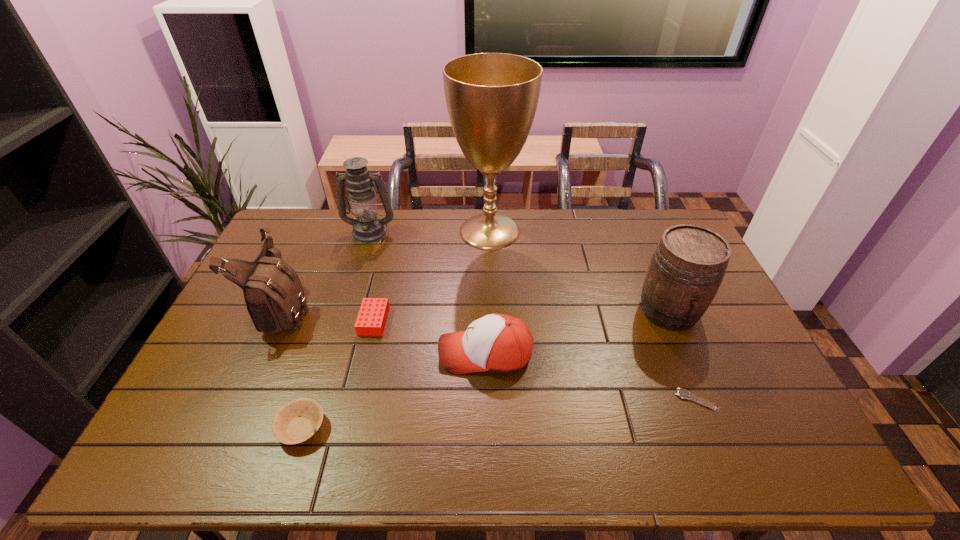
I want to click on trophy cup, so click(491, 98).

You are a GUI agent. You are given a task and a screenshot of the screen. Output one action in this format:
    pyautogui.click(x=<x>, y=<y>)
    Task: Click on the oil lamp
    This screenshot has height=540, width=960.
    Given the screenshot: What is the action you would take?
    pyautogui.click(x=368, y=227)

Locate an element on the screen. This screenshot has width=960, height=540. the leftmost object is located at coordinates (274, 296).

Identify the location of cider. (688, 265).

In order to click on baseball cap in this screenshot , I will do `click(496, 342)`.

The width and height of the screenshot is (960, 540). Identify the location of Lego. (372, 316).

I want to click on bowl, so click(x=295, y=422).

This screenshot has height=540, width=960. Find the location of `watch`. watch is located at coordinates (682, 393).

In order to click on vacant space situated 0.320m on the left of the tallest object in this screenshot , I will do `click(366, 231)`.

Where is `vacant space situated 0.340m on the front of the oil lamp`? The width and height of the screenshot is (960, 540). vacant space situated 0.340m on the front of the oil lamp is located at coordinates (346, 313).